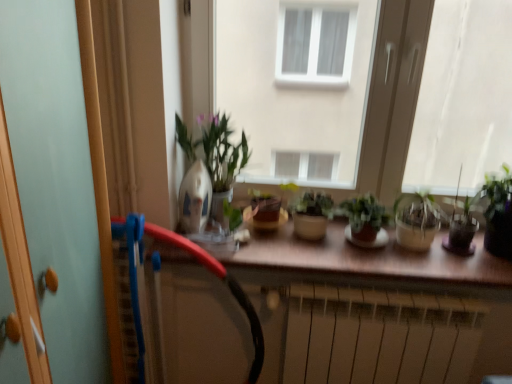
Question: Does transparent glass window at right, arranged as the 1th window when viewed from the right, appear on the right side of translucent glass pot at right, the third houseplant when ordered from left to right?

Choices:
 (A) no
 (B) yes

Answer: (B)

Question: Can you confirm if transparent glass window at right, arranged as the 1th window when viewed from the right, is bigger than translucent glass pot at right, the third houseplant when ordered from left to right?

Choices:
 (A) no
 (B) yes

Answer: (B)

Question: Would you say translucent glass pot at right, the third houseplant when ordered from left to right, is part of transparent glass window at right, arranged as the 1th window when viewed from the right,'s contents?

Choices:
 (A) yes
 (B) no

Answer: (B)

Question: Is transparent glass window at right, arranged as the 1th window when viewed from the right, in contact with translucent glass pot at right, the 2th houseplant from the right?

Choices:
 (A) yes
 (B) no

Answer: (B)

Question: From a real-world perspective, is transparent glass window at right, the second window positioned from the left, located beneath translucent glass pot at right, the 2th houseplant from the right?

Choices:
 (A) yes
 (B) no

Answer: (B)

Question: Does point (374, 233) appear closer or farther from the camera than point (506, 168)?

Choices:
 (A) farther
 (B) closer

Answer: (B)

Question: Considering the positions of green matte plant at center, the 2th houseplant viewed from the left, and translucent glass vase at right, the 4th houseplant in the left-to-right sequence, in the image, is green matte plant at center, the 2th houseplant viewed from the left, wider or thinner than translucent glass vase at right, the 4th houseplant in the left-to-right sequence,?

Choices:
 (A) wide
 (B) thin

Answer: (B)

Question: From their relative heights in the image, would you say green matte plant at center, which is counted as the third houseplant, starting from the right, is taller or shorter than translucent glass vase at right, acting as the first houseplant starting from the right?

Choices:
 (A) short
 (B) tall

Answer: (A)

Question: Is green matte plant at center, the 2th houseplant viewed from the left, in front of or behind translucent glass vase at right, acting as the first houseplant starting from the right, in the image?

Choices:
 (A) behind
 (B) front

Answer: (A)

Question: Is brown matte counter top at center taller or shorter than transparent glass window at center, placed as the 1th window when sorted from left to right?

Choices:
 (A) tall
 (B) short

Answer: (B)

Question: Looking at their shapes, would you say brown matte counter top at center is wider or thinner than transparent glass window at center, the second window positioned from the right?

Choices:
 (A) thin
 (B) wide

Answer: (B)

Question: Is point (259, 248) closer or farther from the camera than point (399, 97)?

Choices:
 (A) farther
 (B) closer

Answer: (B)

Question: From the image's perspective, is brown matte counter top at center positioned above or below transparent glass window at center, placed as the 1th window when sorted from left to right?

Choices:
 (A) above
 (B) below

Answer: (B)

Question: Looking at their shapes, would you say black rubber garden hose at center is wider or thinner than translucent glass pot at right, the third houseplant when ordered from left to right?

Choices:
 (A) thin
 (B) wide

Answer: (A)

Question: From a real-world perspective, is black rubber garden hose at center above or below translucent glass pot at right, the 2th houseplant from the right?

Choices:
 (A) above
 (B) below

Answer: (B)